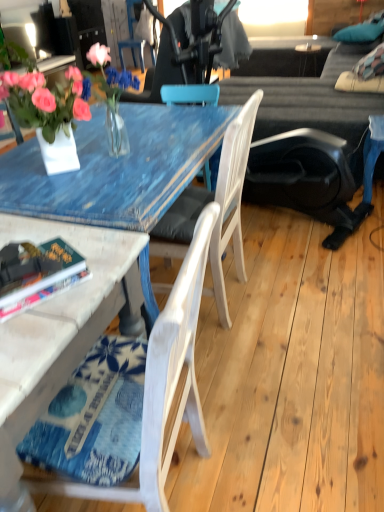
Locate an element on the screen. The image size is (384, 512). vacant region above hardcover book at lower left (from a real-world perspective) is located at coordinates (38, 267).